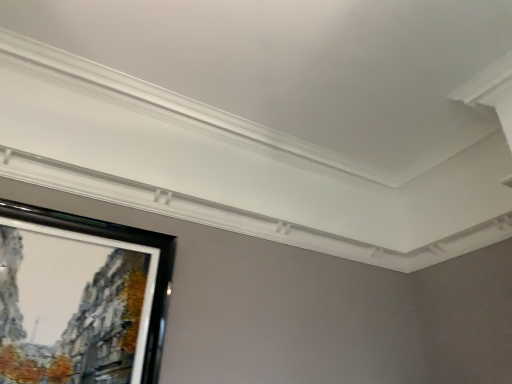
Describe the element at coordinates (80, 299) in the screenshot. I see `black glossy picture frame at lower left` at that location.

The height and width of the screenshot is (384, 512). Find the location of `black glossy picture frame at lower left`. black glossy picture frame at lower left is located at coordinates (80, 299).

Measure the distance between black glossy picture frame at lower left and camera.

The distance of black glossy picture frame at lower left from camera is 1.65 meters.

Identify the location of black glossy picture frame at lower left. (80, 299).